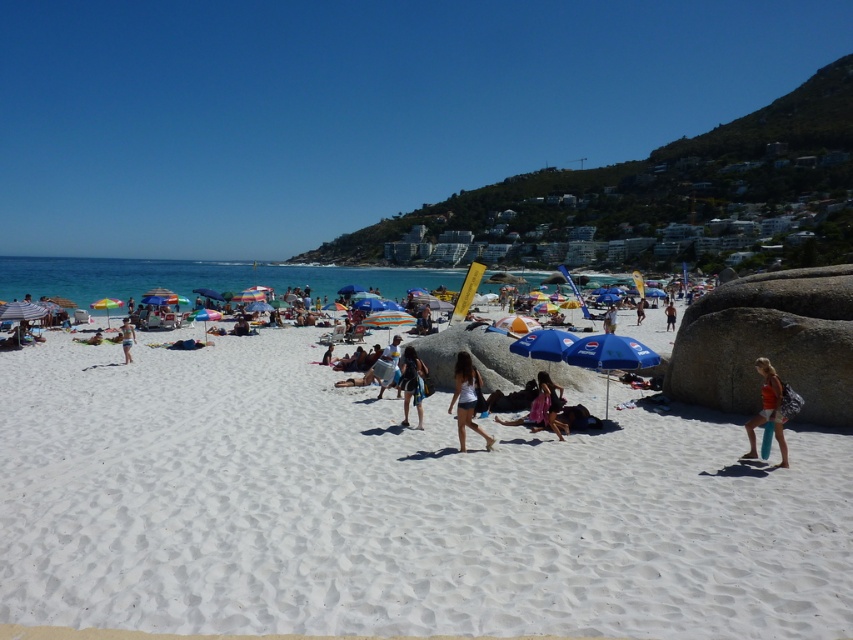
Is white cotton shirt at center shorter than dark blue shorts at center?

Yes, white cotton shirt at center is shorter than dark blue shorts at center.

Which of these two, white cotton shirt at center or dark blue shorts at center, stands taller?

With more height is dark blue shorts at center.

Measure the distance between white cotton shirt at center and camera.

white cotton shirt at center and camera are 29.26 meters apart.

This screenshot has width=853, height=640. Find the location of `white cotton shirt at center`. white cotton shirt at center is located at coordinates (608, 317).

Which is above, blue fabric umbrella at center or matte pink swimsuit at center?

blue fabric umbrella at center is higher up.

Can you confirm if blue fabric umbrella at center is positioned below matte pink swimsuit at center?

Incorrect, blue fabric umbrella at center is not positioned below matte pink swimsuit at center.

Locate an element on the screen. blue fabric umbrella at center is located at coordinates (608, 355).

Consider the image. Can you confirm if green fabric umbrella at center is bigger than white cotton shirt at center?

Correct, green fabric umbrella at center is larger in size than white cotton shirt at center.

Does point (103, 308) lie in front of point (610, 317)?

That is False.

At what (x,y) coordinates should I click in order to perform the action: click on green fabric umbrella at center. Please return your answer as a coordinate pair (x, y). The image size is (853, 640). Looking at the image, I should click on click(106, 305).